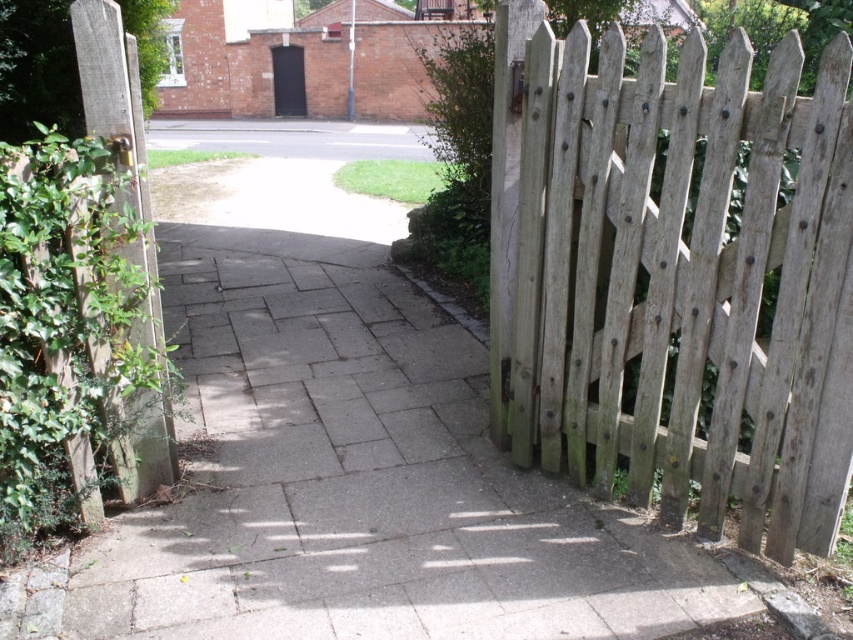
In the scene shown: You are a delivery robot with a 1.2 meter wide package. You need to navigate along the gray concrete pavement at center while avoiding the weathered wood fence at right. Can you safely pass through the area between them without hitting the fence?

The gray concrete pavement at center is further to the viewer than the weathered wood fence at right, meaning there is enough space between them for the robot to pass safely. Since the robot is 1.2 meters wide, it can navigate the path between them without hitting the fence.